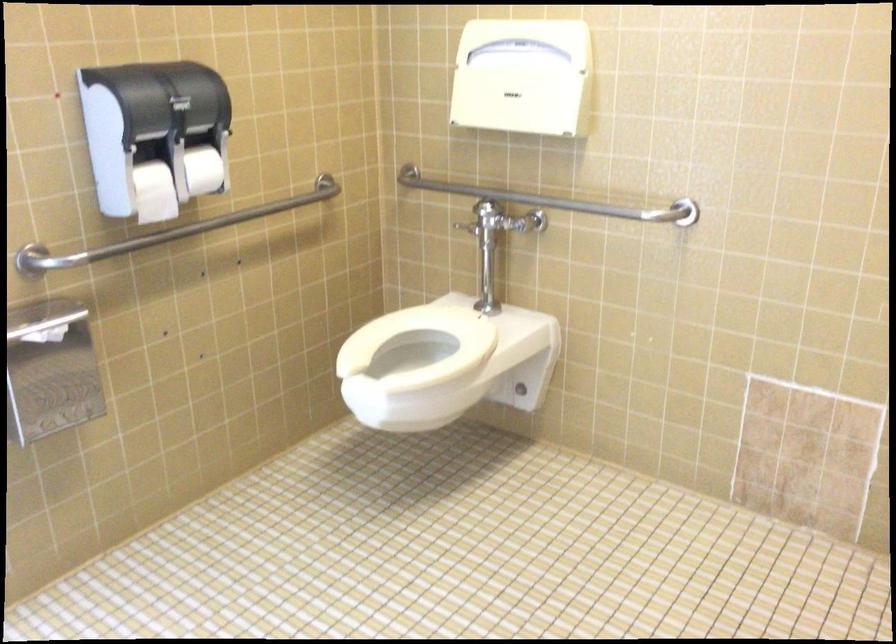
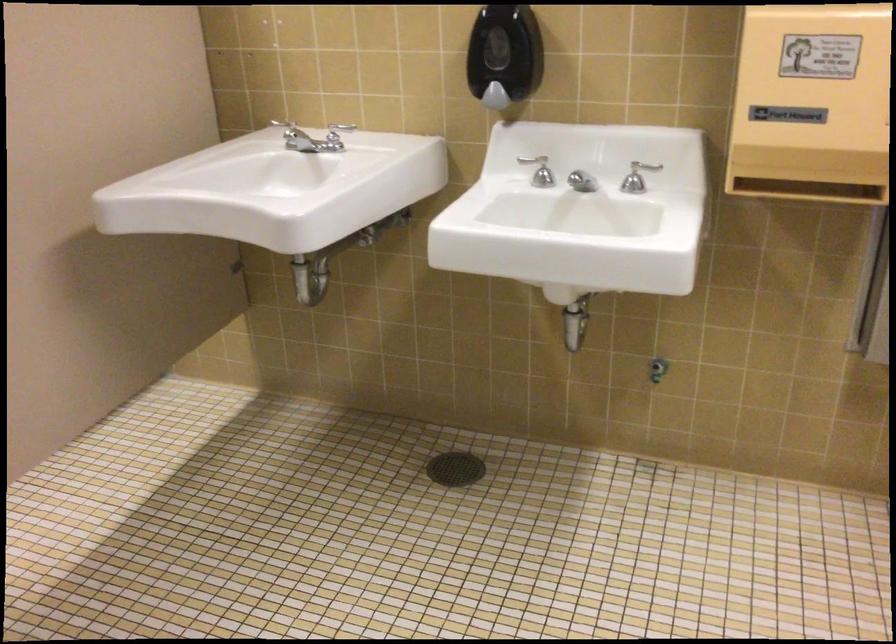
The images are taken continuously from a first-person perspective. In which direction are you moving?

The cameraman moved toward right, backward.